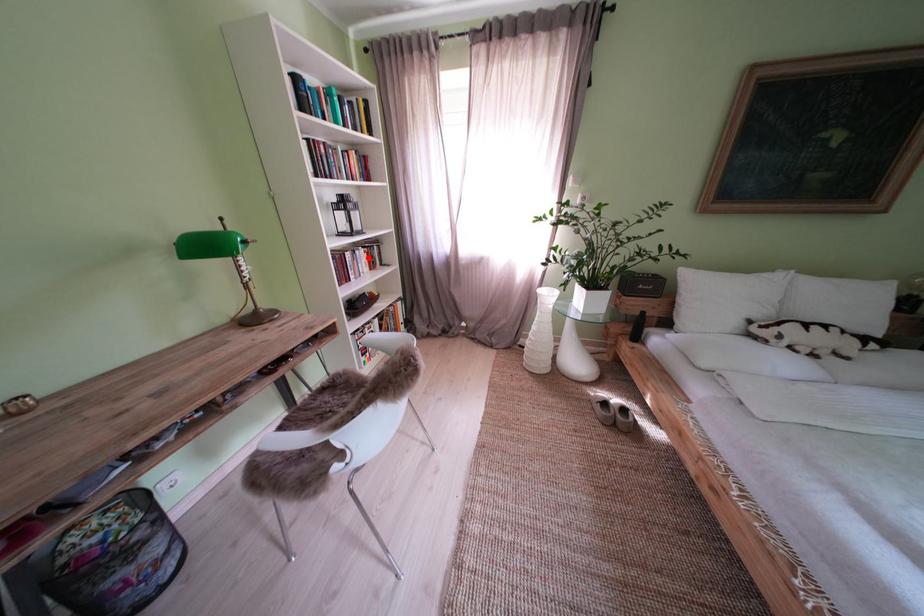
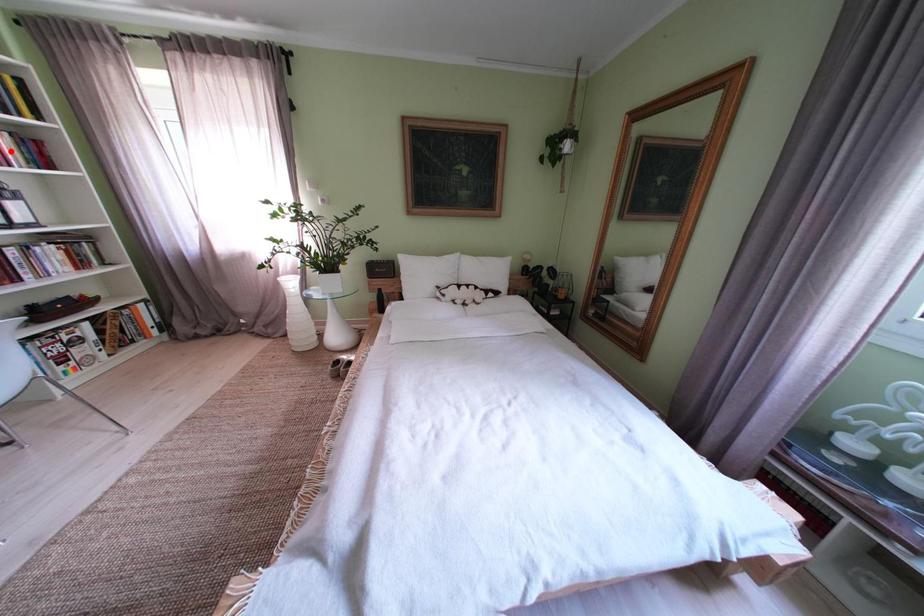
I am providing you with two images of the same scene from different viewpoints. A red point is marked on the first image and another point is marked on the second image. Does the point marked in image1 correspond to the same location as the one in image2?

No